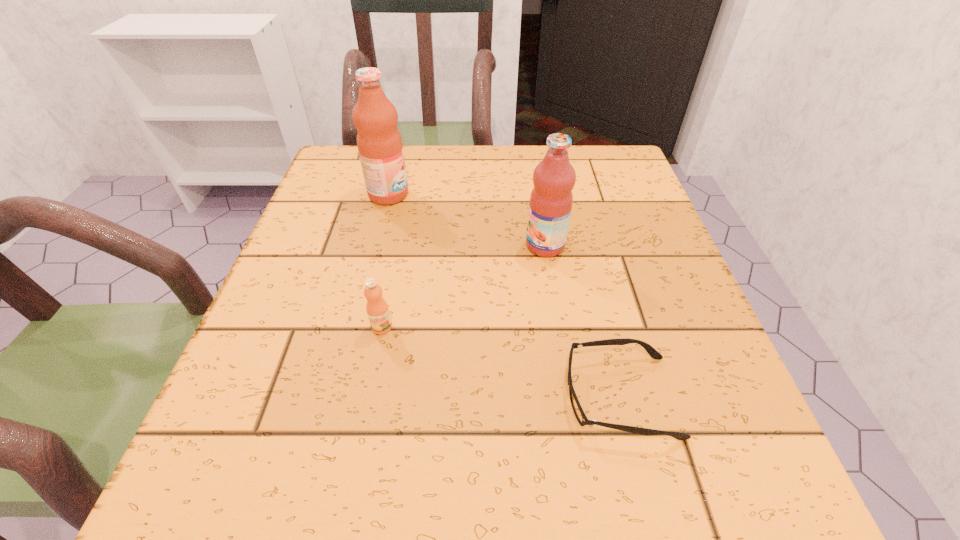
Image resolution: width=960 pixels, height=540 pixels. What are the coordinates of `vacant area located 0.070m on the front label of the nearer fruit juice` in the screenshot? It's located at (491, 246).

You are a GUI agent. You are given a task and a screenshot of the screen. Output one action in this format:
    pyautogui.click(x=<x>, y=<y>)
    Task: Click on the free point located on the front label of the nearer fruit juice
    Image resolution: width=960 pixels, height=540 pixels.
    Given the screenshot: What is the action you would take?
    pyautogui.click(x=338, y=246)

Find the location of a particular element. The width and height of the screenshot is (960, 540). vacant area located on the front label of the orange juice is located at coordinates (372, 378).

Locate an element on the screen. This screenshot has height=540, width=960. vacant space positioned 0.270m on the front-facing side of the shortest object is located at coordinates (378, 396).

Identify the location of vacant space located 0.260m on the front-facing side of the shortest object. The image size is (960, 540). (385, 396).

I want to click on free space located on the front-facing side of the shortest object, so (x=350, y=396).

The width and height of the screenshot is (960, 540). Identify the location of object located in the far edge section of the desktop. (379, 142).

Where is `object located at the left edge`? The image size is (960, 540). object located at the left edge is located at coordinates (379, 142).

Identify the location of object positioned at the right edge. The height and width of the screenshot is (540, 960). (577, 409).

Find the location of a particular element. Image resolution: width=960 pixels, height=540 pixels. object that is at the far left corner is located at coordinates (379, 142).